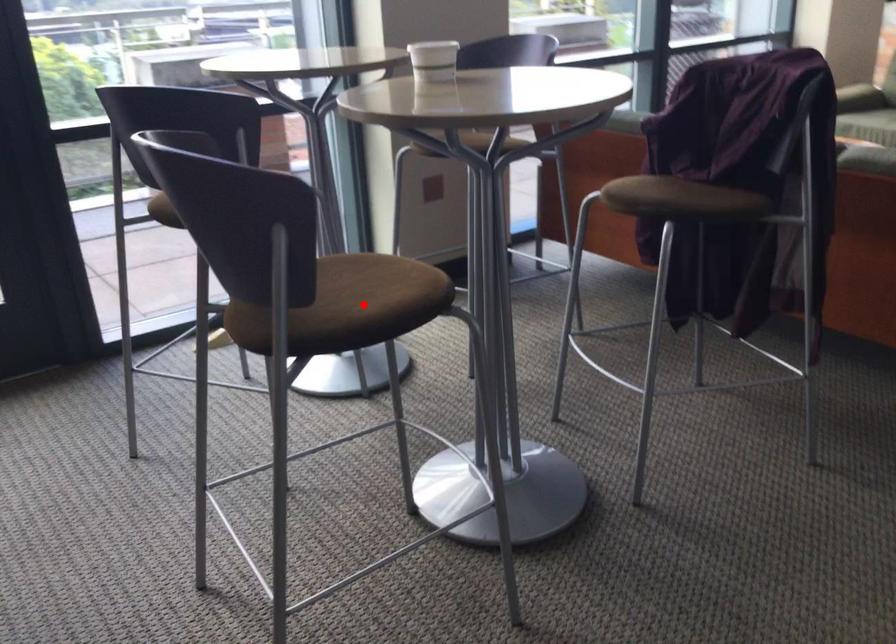
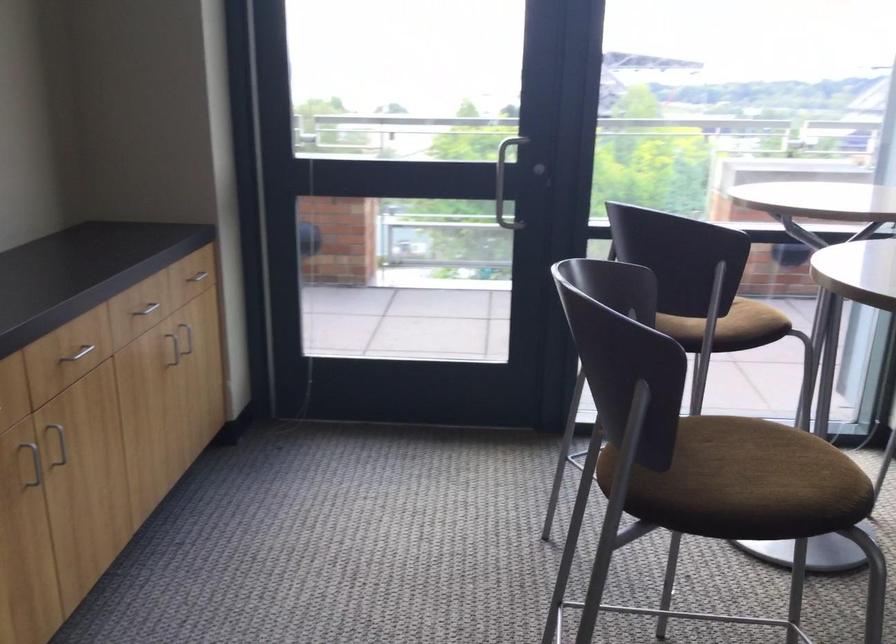
The point at the highlighted location is marked in the first image. Where is the corresponding point in the second image?

(739, 482)